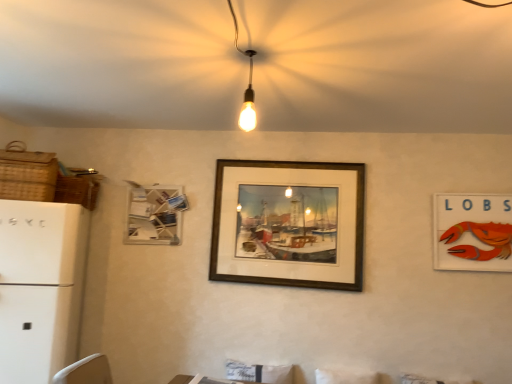
Where is `woven brown basket at upper left, placed as the second basket when sorted from front to back`? woven brown basket at upper left, placed as the second basket when sorted from front to back is located at coordinates [x=77, y=190].

What do you see at coordinates (472, 232) in the screenshot?
I see `orange felt lobster sign at right, marked as the third picture frame in a left-to-right arrangement` at bounding box center [472, 232].

What is the approximate width of orange felt lobster sign at right, the 1th picture frame viewed from the right?

orange felt lobster sign at right, the 1th picture frame viewed from the right, is 2.65 inches in width.

Describe the element at coordinates (155, 215) in the screenshot. This screenshot has height=384, width=512. I see `white matte picture frame at upper left, the first picture frame when ordered from left to right` at that location.

This screenshot has width=512, height=384. In order to click on woven brown basket at left, which is the first basket from front to back in this screenshot , I will do `click(27, 174)`.

The height and width of the screenshot is (384, 512). Identify the location of woven brown basket at upper left, marked as the first basket in a back-to-front arrangement. (77, 190).

Is woven brown basket at upper left, marked as the first basket in a back-to-front arrangement, further to camera compared to white matte refrigerator at left?

That is True.

Which of these two, woven brown basket at upper left, placed as the second basket when sorted from front to back, or white matte refrigerator at left, is bigger?

Bigger between the two is white matte refrigerator at left.

Is woven brown basket at upper left, marked as the first basket in a back-to-front arrangement, oriented towards white matte refrigerator at left?

No, woven brown basket at upper left, marked as the first basket in a back-to-front arrangement, is not oriented towards white matte refrigerator at left.

Can white matte refrigerator at left be found inside woven brown basket at upper left, marked as the first basket in a back-to-front arrangement?

No, woven brown basket at upper left, marked as the first basket in a back-to-front arrangement, does not contain white matte refrigerator at left.

Who is smaller, wooden frame at center, arranged as the 2th picture frame when viewed from the right, or woven brown basket at left, the 2th basket from the back?

woven brown basket at left, the 2th basket from the back.

Is wooden frame at center, the second picture frame viewed from the left, wider than woven brown basket at left, the 2th basket from the back?

No, wooden frame at center, the second picture frame viewed from the left, is not wider than woven brown basket at left, the 2th basket from the back.

Is wooden frame at center, arranged as the 2th picture frame when viewed from the right, to the right of woven brown basket at left, the 2th basket from the back, from the viewer's perspective?

Indeed, wooden frame at center, arranged as the 2th picture frame when viewed from the right, is positioned on the right side of woven brown basket at left, the 2th basket from the back.

Looking at their sizes, would you say wooden frame at center, arranged as the 2th picture frame when viewed from the right, is wider or thinner than woven brown basket at upper left, marked as the first basket in a back-to-front arrangement?

In the image, wooden frame at center, arranged as the 2th picture frame when viewed from the right, appears to be more narrow than woven brown basket at upper left, marked as the first basket in a back-to-front arrangement.

Is wooden frame at center, arranged as the 2th picture frame when viewed from the right, positioned behind woven brown basket at upper left, marked as the first basket in a back-to-front arrangement?

Yes, it is.

Which of these two, wooden frame at center, arranged as the 2th picture frame when viewed from the right, or woven brown basket at upper left, placed as the second basket when sorted from front to back, stands taller?

Standing taller between the two is wooden frame at center, arranged as the 2th picture frame when viewed from the right.

How many degrees apart are the facing directions of wooden frame at center, arranged as the 2th picture frame when viewed from the right, and woven brown basket at upper left, placed as the second basket when sorted from front to back?

They differ by 5.75 degrees in their facing directions.

Is woven brown basket at left, the 2th basket from the back, to the right of orange felt lobster sign at right, marked as the third picture frame in a left-to-right arrangement, from the viewer's perspective?

Incorrect, woven brown basket at left, the 2th basket from the back, is not on the right side of orange felt lobster sign at right, marked as the third picture frame in a left-to-right arrangement.

Is woven brown basket at left, which is the first basket from front to back, turned away from orange felt lobster sign at right, the 1th picture frame viewed from the right?

No, woven brown basket at left, which is the first basket from front to back, is not facing away from orange felt lobster sign at right, the 1th picture frame viewed from the right.

From a real-world perspective, is woven brown basket at left, the 2th basket from the back, above or below orange felt lobster sign at right, marked as the third picture frame in a left-to-right arrangement?

woven brown basket at left, the 2th basket from the back, is situated higher than orange felt lobster sign at right, marked as the third picture frame in a left-to-right arrangement, in the real world.

Which of these two, woven brown basket at left, the 2th basket from the back, or orange felt lobster sign at right, the 1th picture frame viewed from the right, is smaller?

orange felt lobster sign at right, the 1th picture frame viewed from the right, is smaller.

Could woven brown basket at left, which is the first basket from front to back, be considered to be inside white matte picture frame at upper left, the first picture frame when ordered from left to right?

Actually, woven brown basket at left, which is the first basket from front to back, is outside white matte picture frame at upper left, the first picture frame when ordered from left to right.

Considering the relative sizes of white matte picture frame at upper left, which is the 3th picture frame from right to left, and woven brown basket at left, the 2th basket from the back, in the image provided, is white matte picture frame at upper left, which is the 3th picture frame from right to left, smaller than woven brown basket at left, the 2th basket from the back,?

Indeed, white matte picture frame at upper left, which is the 3th picture frame from right to left, has a smaller size compared to woven brown basket at left, the 2th basket from the back.

From the image's perspective, between white matte picture frame at upper left, the first picture frame when ordered from left to right, and woven brown basket at left, the 2th basket from the back, who is located below?

white matte picture frame at upper left, the first picture frame when ordered from left to right, is shown below in the image.

From the image's perspective, is orange felt lobster sign at right, marked as the third picture frame in a left-to-right arrangement, beneath woven brown basket at upper left, marked as the first basket in a back-to-front arrangement?

Yes, from the image's perspective, orange felt lobster sign at right, marked as the third picture frame in a left-to-right arrangement, is beneath woven brown basket at upper left, marked as the first basket in a back-to-front arrangement.

From a real-world perspective, which is physically above, orange felt lobster sign at right, the 1th picture frame viewed from the right, or woven brown basket at upper left, marked as the first basket in a back-to-front arrangement?

woven brown basket at upper left, marked as the first basket in a back-to-front arrangement, from a real-world perspective.

Is orange felt lobster sign at right, marked as the third picture frame in a left-to-right arrangement, turned away from woven brown basket at upper left, placed as the second basket when sorted from front to back?

That's not correct — orange felt lobster sign at right, marked as the third picture frame in a left-to-right arrangement, is not looking away from woven brown basket at upper left, placed as the second basket when sorted from front to back.

Where is `basket behind the orange felt lobster sign at right, the 1th picture frame viewed from the right`? The width and height of the screenshot is (512, 384). basket behind the orange felt lobster sign at right, the 1th picture frame viewed from the right is located at coordinates (77, 190).

In the scene shown: Visually, is wooden frame at center, arranged as the 2th picture frame when viewed from the right, positioned to the left or to the right of white matte picture frame at upper left, which is the 3th picture frame from right to left?

→ wooden frame at center, arranged as the 2th picture frame when viewed from the right, is positioned on white matte picture frame at upper left, which is the 3th picture frame from right to left,'s right side.

The height and width of the screenshot is (384, 512). I want to click on picture frame behind the wooden frame at center, arranged as the 2th picture frame when viewed from the right, so click(155, 215).

Between wooden frame at center, the second picture frame viewed from the left, and white matte picture frame at upper left, which is the 3th picture frame from right to left, which one is positioned in front?

wooden frame at center, the second picture frame viewed from the left, is closer to the camera.

This screenshot has height=384, width=512. Identify the location of fridge in front of the woven brown basket at upper left, placed as the second basket when sorted from front to back. (40, 287).

From the woven brown basket at left, which is the first basket from front to back, count 2nd picture frame to the right and point to it. Please provide its 2D coordinates.

[(289, 224)]

When comparing their distances from wooden frame at center, arranged as the 2th picture frame when viewed from the right, does woven brown basket at left, which is the first basket from front to back, or white matte picture frame at upper left, which is the 3th picture frame from right to left, seem closer?

The object closer to wooden frame at center, arranged as the 2th picture frame when viewed from the right, is white matte picture frame at upper left, which is the 3th picture frame from right to left.

Looking at the image, which one is located further to orange felt lobster sign at right, marked as the third picture frame in a left-to-right arrangement, white matte refrigerator at left or white matte picture frame at upper left, which is the 3th picture frame from right to left?

white matte refrigerator at left lies further to orange felt lobster sign at right, marked as the third picture frame in a left-to-right arrangement, than the other object.

Looking at this image, from the image, which object appears to be nearer to woven brown basket at left, the 2th basket from the back, wooden frame at center, arranged as the 2th picture frame when viewed from the right, or white matte refrigerator at left?

The object closer to woven brown basket at left, the 2th basket from the back, is white matte refrigerator at left.

When comparing their distances from white matte picture frame at upper left, which is the 3th picture frame from right to left, does white matte refrigerator at left or woven brown basket at left, the 2th basket from the back, seem further?

woven brown basket at left, the 2th basket from the back, is further to white matte picture frame at upper left, which is the 3th picture frame from right to left.

When comparing their distances from woven brown basket at left, which is the first basket from front to back, does wooden frame at center, arranged as the 2th picture frame when viewed from the right, or white matte picture frame at upper left, which is the 3th picture frame from right to left, seem further?

wooden frame at center, arranged as the 2th picture frame when viewed from the right, is further to woven brown basket at left, which is the first basket from front to back.

Based on their spatial positions, is orange felt lobster sign at right, marked as the third picture frame in a left-to-right arrangement, or woven brown basket at upper left, placed as the second basket when sorted from front to back, further from woven brown basket at left, which is the first basket from front to back?

orange felt lobster sign at right, marked as the third picture frame in a left-to-right arrangement, is further to woven brown basket at left, which is the first basket from front to back.

Looking at the image, which one is located closer to white matte picture frame at upper left, which is the 3th picture frame from right to left, orange felt lobster sign at right, the 1th picture frame viewed from the right, or woven brown basket at upper left, placed as the second basket when sorted from front to back?

woven brown basket at upper left, placed as the second basket when sorted from front to back, is closer to white matte picture frame at upper left, which is the 3th picture frame from right to left.

Considering their positions, is wooden frame at center, arranged as the 2th picture frame when viewed from the right, positioned closer to white matte picture frame at upper left, which is the 3th picture frame from right to left, than orange felt lobster sign at right, marked as the third picture frame in a left-to-right arrangement?

wooden frame at center, arranged as the 2th picture frame when viewed from the right, is closer to white matte picture frame at upper left, which is the 3th picture frame from right to left.

The image size is (512, 384). Identify the location of picture frame between white matte refrigerator at left and wooden frame at center, the second picture frame viewed from the left, from left to right. (155, 215).

Find the location of `picture frame between woven brown basket at upper left, marked as the first basket in a back-to-front arrangement, and wooden frame at center, the second picture frame viewed from the left, from left to right`. picture frame between woven brown basket at upper left, marked as the first basket in a back-to-front arrangement, and wooden frame at center, the second picture frame viewed from the left, from left to right is located at coordinates (155, 215).

At what (x,y) coordinates should I click in order to perform the action: click on basket between woven brown basket at left, the 2th basket from the back, and white matte picture frame at upper left, which is the 3th picture frame from right to left, in the horizontal direction. Please return your answer as a coordinate pair (x, y). Looking at the image, I should click on (77, 190).

You are a GUI agent. You are given a task and a screenshot of the screen. Output one action in this format:
    pyautogui.click(x=<x>, y=<y>)
    Task: Click on the basket located between woven brown basket at left, the 2th basket from the back, and orange felt lobster sign at right, the 1th picture frame viewed from the right, in the left-right direction
    
    Given the screenshot: What is the action you would take?
    pyautogui.click(x=77, y=190)